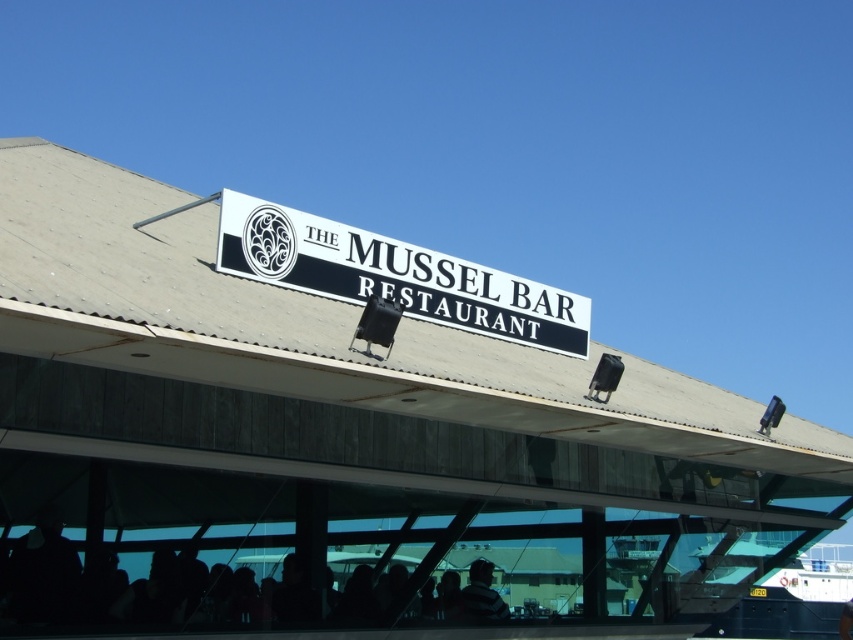
Who is positioned more to the right, silhouette skin at lower center or dark gray sweater at lower center?

From the viewer's perspective, dark gray sweater at lower center appears more on the right side.

Between point (61, 502) and point (482, 582), which one is positioned in front?

Point (482, 582)

The width and height of the screenshot is (853, 640). Describe the element at coordinates (239, 556) in the screenshot. I see `silhouette skin at lower center` at that location.

Locate an element on the screen. silhouette skin at lower center is located at coordinates (239, 556).

Is silhouette skin at lower center below white plastic sign at center?

Correct, silhouette skin at lower center is located below white plastic sign at center.

Which is behind, point (456, 536) or point (496, 292)?

Positioned behind is point (496, 292).

The image size is (853, 640). What do you see at coordinates (239, 556) in the screenshot?
I see `silhouette skin at lower center` at bounding box center [239, 556].

Locate an element on the screen. This screenshot has height=640, width=853. silhouette skin at lower center is located at coordinates (239, 556).

Locate an element on the screen. The width and height of the screenshot is (853, 640). white plastic sign at center is located at coordinates (393, 275).